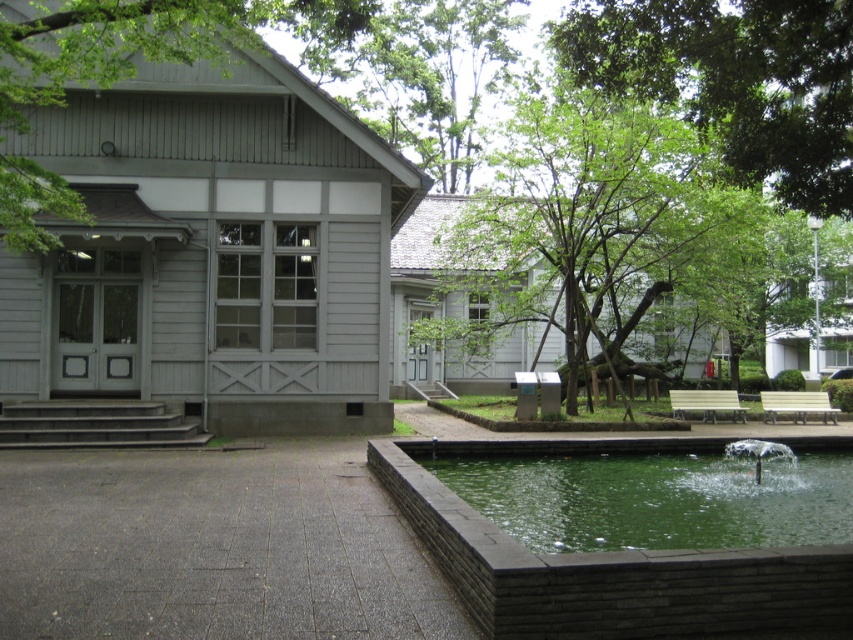
Question: Which object is closer to the camera taking this photo?

Choices:
 (A) green wood tree at upper left
 (B) green leafy tree at upper center
 (C) green stone water at lower right

Answer: (B)

Question: Is green leafy tree at center smaller than green wood tree at upper left?

Choices:
 (A) yes
 (B) no

Answer: (B)

Question: Is green leafy tree at upper center above green wood tree at upper left?

Choices:
 (A) yes
 (B) no

Answer: (B)

Question: Which object is closer to the camera taking this photo?

Choices:
 (A) green leafy tree at upper center
 (B) green leafy tree at center

Answer: (A)

Question: Is green stone water at lower right below green wood tree at upper left?

Choices:
 (A) no
 (B) yes

Answer: (B)

Question: Which of the following is the farthest from the observer?

Choices:
 (A) green leafy tree at center
 (B) green leafy tree at upper center

Answer: (A)